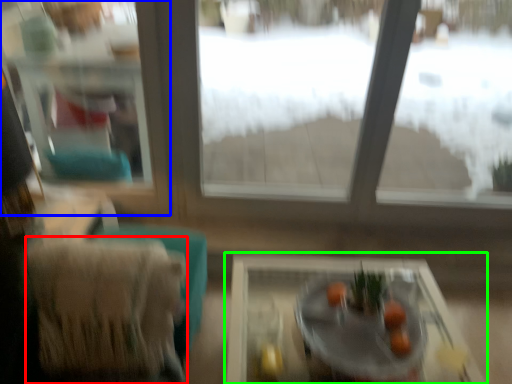
Question: Considering the real-world distances, which object is closest to armchair (highlighted by a red box)? window frame (highlighted by a blue box) or table (highlighted by a green box).

Choices:
 (A) window frame
 (B) table

Answer: (B)